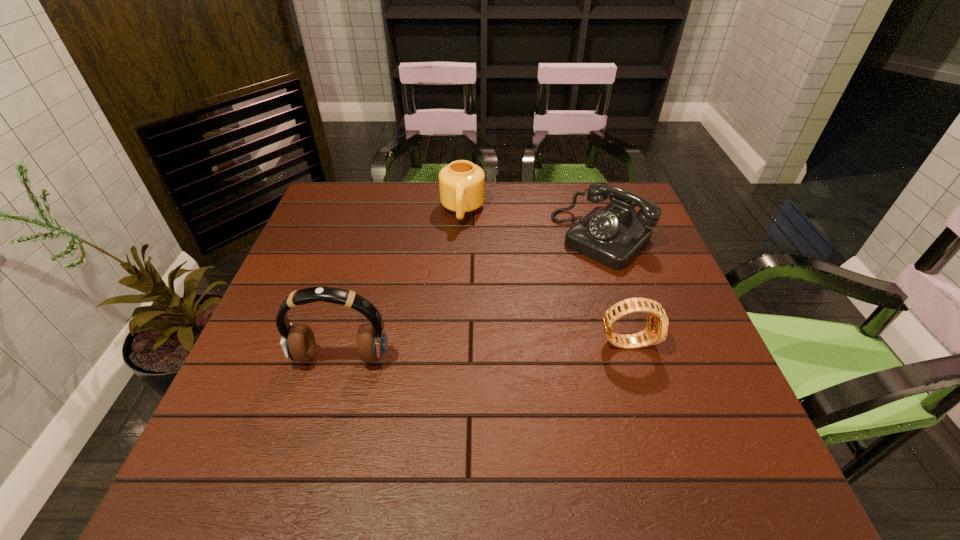
Locate an element on the screen. This screenshot has height=540, width=960. the tallest object is located at coordinates (298, 342).

I want to click on headset, so click(298, 342).

Locate an element on the screen. The image size is (960, 540). watch is located at coordinates (656, 331).

You are a GUI agent. You are given a task and a screenshot of the screen. Output one action in this format:
    pyautogui.click(x=<x>, y=<y>)
    Task: Click on the telephone
    The image size is (960, 540).
    Given the screenshot: What is the action you would take?
    pyautogui.click(x=613, y=235)

You are a GUI agent. You are given a task and a screenshot of the screen. Output one action in this format:
    pyautogui.click(x=<x>, y=<y>)
    Task: Click on the third object from right to left
    This screenshot has width=960, height=540.
    Given the screenshot: What is the action you would take?
    coord(461,183)

At what (x,y) coordinates should I click in order to perform the action: click on free spot located 0.100m on the face of the watch. Please return your answer as a coordinate pair (x, y). Looking at the image, I should click on (699, 341).

Find the location of a particular element. Image resolution: width=960 pixels, height=540 pixels. free spot located on the dial of the telephone is located at coordinates (527, 307).

The height and width of the screenshot is (540, 960). I want to click on vacant space located 0.140m on the dial of the telephone, so click(546, 289).

Identify the location of vacant area located on the dial of the telephone. Image resolution: width=960 pixels, height=540 pixels. (522, 311).

Image resolution: width=960 pixels, height=540 pixels. I want to click on vacant space located on the handle side of the second object from left to right, so click(459, 243).